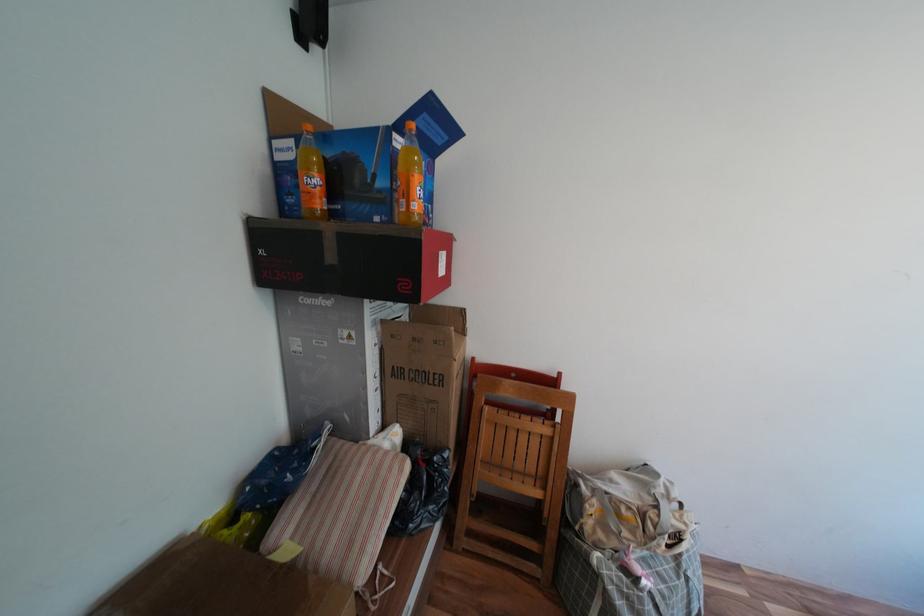
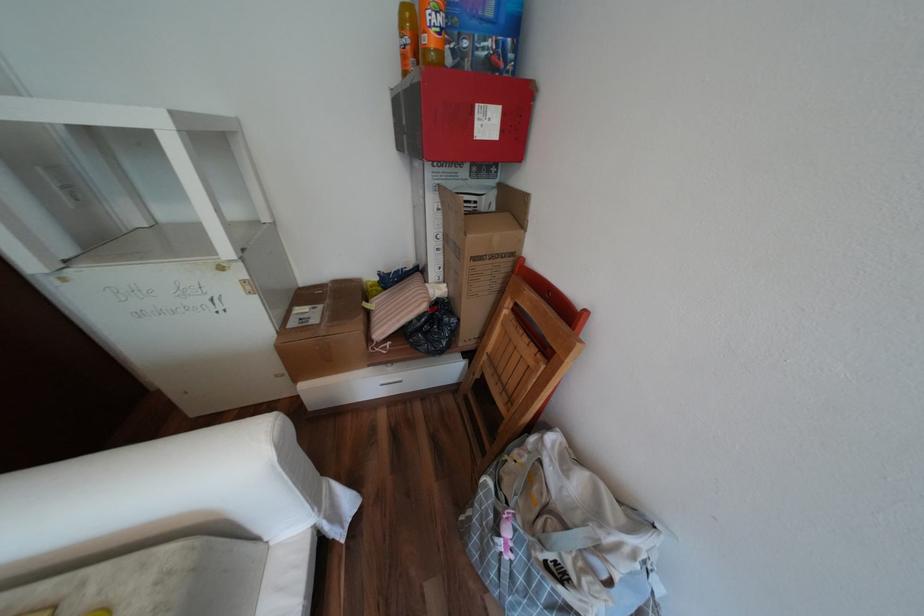
Based on the continuous images, in which direction is the camera rotating?

The camera's rotation is toward left-down.